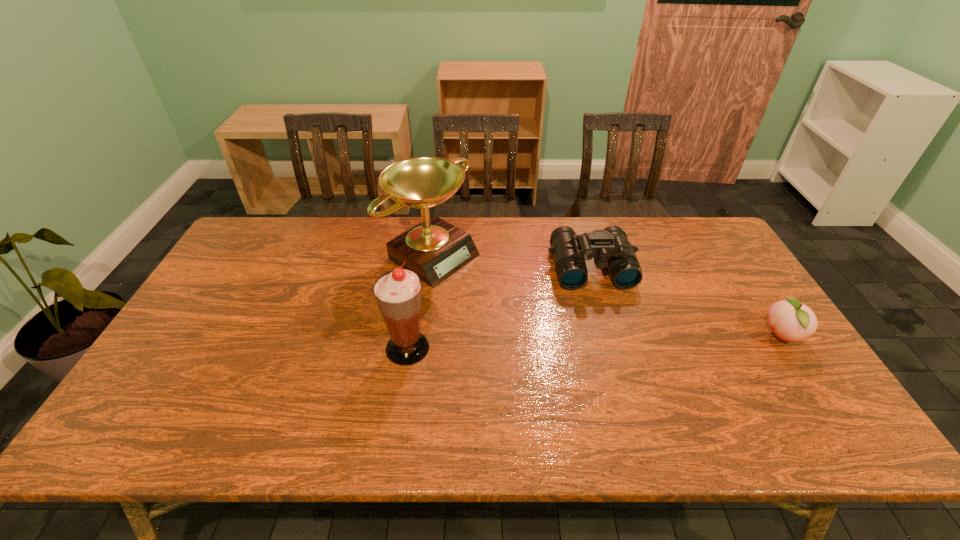
I want to click on vacant space that is in between the award and the rightmost object, so click(x=608, y=295).

Where is `empty space that is in between the rightmost object and the smoothie`? This screenshot has width=960, height=540. empty space that is in between the rightmost object and the smoothie is located at coordinates (594, 342).

This screenshot has width=960, height=540. I want to click on free space between the binoculars and the award, so click(513, 261).

You are a GUI agent. You are given a task and a screenshot of the screen. Output one action in this format:
    pyautogui.click(x=<x>, y=<y>)
    Task: Click on the free point between the peach and the award
    
    Given the screenshot: What is the action you would take?
    pyautogui.click(x=608, y=295)

Find the location of `the closest object relative to the award`. the closest object relative to the award is located at coordinates (398, 293).

Identify which object is the closest to the peach. Please provide its 2D coordinates. Your answer should be formatted as a tuple, i.e. [(x, y)], where the tuple contains the x and y coordinates of a point satisfying the conditions above.

[(610, 248)]

Find the location of a particular element. vacant region that satisfies the following two spatial constraints: 1. on the back side of the smoothie; 2. on the right side of the award is located at coordinates (422, 254).